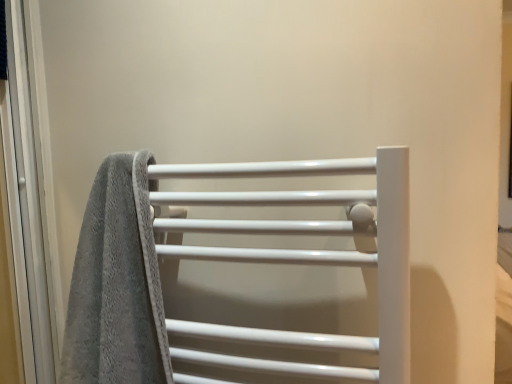
In order to face gray textured towel at left, should I rotate leftwards or rightwards?

It's best to rotate left around 19.172 degrees.

Measure the distance between point (x=112, y=279) and camera.

They are 24.84 inches apart.

The image size is (512, 384). I want to click on gray textured towel at left, so pyautogui.click(x=117, y=284).

Describe the element at coordinates (117, 284) in the screenshot. I see `gray textured towel at left` at that location.

The image size is (512, 384). What are the coordinates of `gray textured towel at left` in the screenshot? It's located at (117, 284).